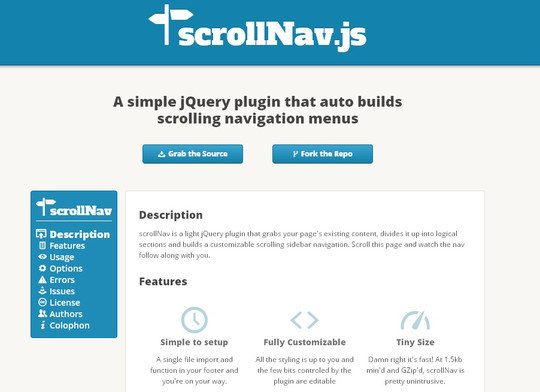
Image resolution: width=540 pixels, height=392 pixels. I want to click on clock, so click(x=191, y=325).